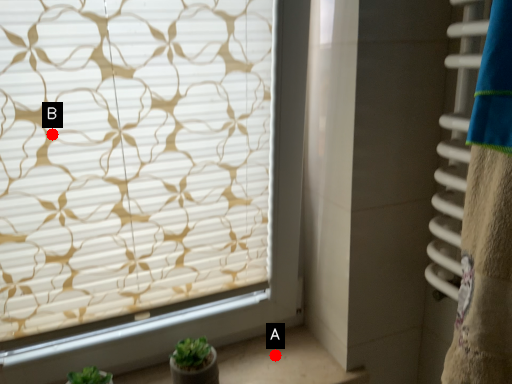
Question: Two points are circled on the image, labeled by A and B beside each circle. Which point is closer to the camera?

Choices:
 (A) A is closer
 (B) B is closer

Answer: (B)